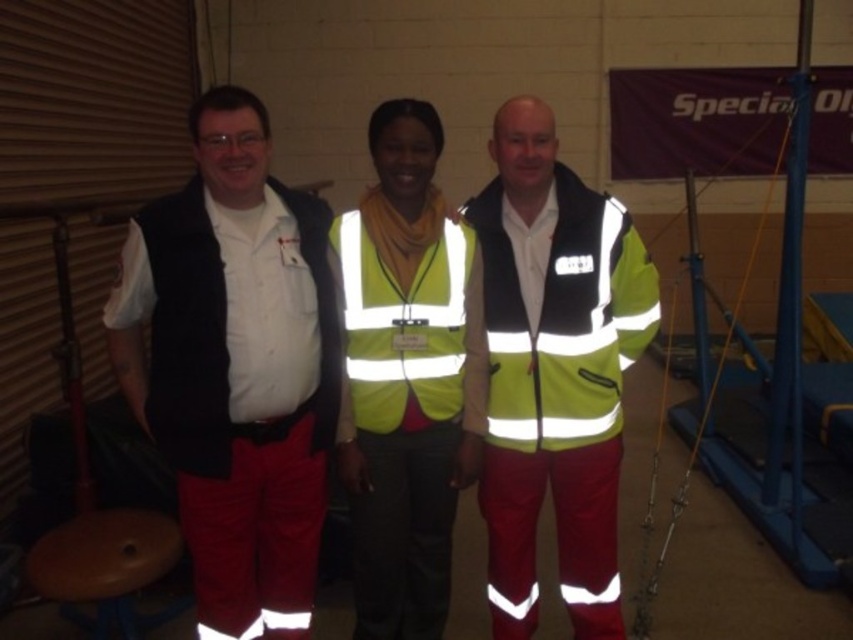
Is matte black vest at left positioned behind high-visibility fabric jacket at center?

No, matte black vest at left is in front of high-visibility fabric jacket at center.

Does matte black vest at left have a greater height compared to high-visibility fabric jacket at center?

No, matte black vest at left is not taller than high-visibility fabric jacket at center.

Which is in front, point (200, 406) or point (544, 225)?

Positioned in front is point (200, 406).

You are a GUI agent. You are given a task and a screenshot of the screen. Output one action in this format:
    pyautogui.click(x=<x>, y=<y>)
    Task: Click on the matte black vest at left
    The width and height of the screenshot is (853, 640).
    Given the screenshot: What is the action you would take?
    pyautogui.click(x=235, y=368)

Between black fabric vest at left and yellow reflective safety vest at center, which one is positioned higher?

Positioned higher is black fabric vest at left.

Measure the distance between black fabric vest at left and yellow reflective safety vest at center.

black fabric vest at left is 9.01 inches away from yellow reflective safety vest at center.

What do you see at coordinates (187, 333) in the screenshot? I see `black fabric vest at left` at bounding box center [187, 333].

Locate an element on the screen. black fabric vest at left is located at coordinates (187, 333).

Is high-visibility fabric safety vest at center positioned before wooden stool at lower left?

No, it is not.

Which is behind, point (532, 408) or point (183, 547)?

The point (183, 547) is behind.

Who is more distant from viewer, (610,408) or (111,538)?

The point (111,538) is behind.

I want to click on high-visibility fabric safety vest at center, so click(561, 320).